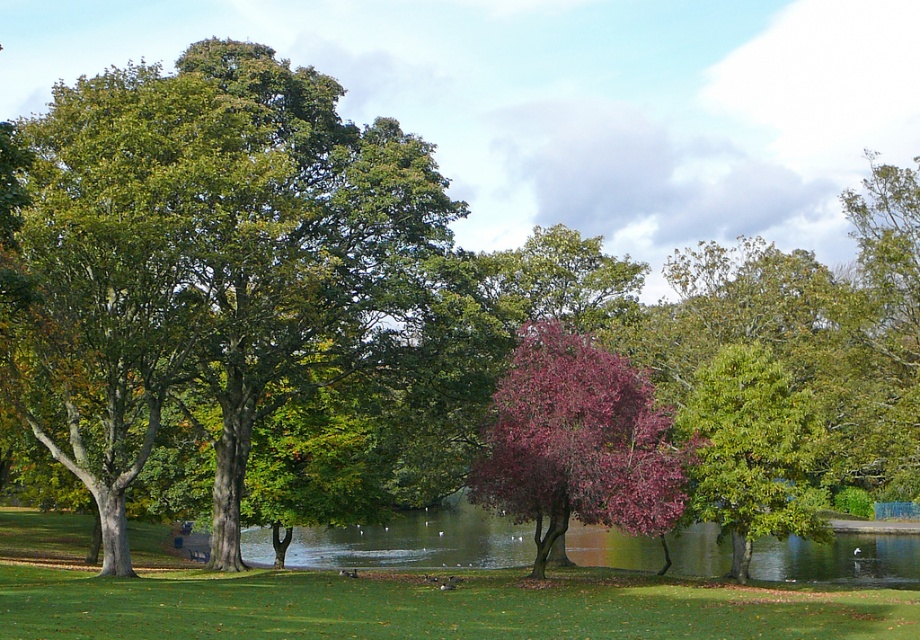
Question: Can you confirm if green leafy tree at left is thinner than green glossy tree at right?

Choices:
 (A) yes
 (B) no

Answer: (B)

Question: Among these points, which one is nearest to the camera?

Choices:
 (A) (426, 280)
 (B) (593, 458)
 (C) (743, 356)

Answer: (B)

Question: Among these objects, which one is farthest from the camera?

Choices:
 (A) green leafy tree at left
 (B) green grassy lake at center
 (C) purple glossy tree at center

Answer: (B)

Question: Is purple glossy tree at center to the left of green grassy lake at center from the viewer's perspective?

Choices:
 (A) no
 (B) yes

Answer: (A)

Question: Does green leafy tree at left appear on the right side of green glossy tree at right?

Choices:
 (A) yes
 (B) no

Answer: (B)

Question: Which point appears farthest from the camera in this image?

Choices:
 (A) (599, 504)
 (B) (199, 49)
 (C) (762, 371)

Answer: (B)